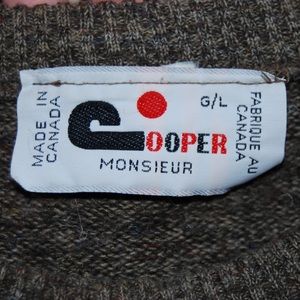
Where is `fabric`? The image size is (300, 300). fabric is located at coordinates (264, 48).